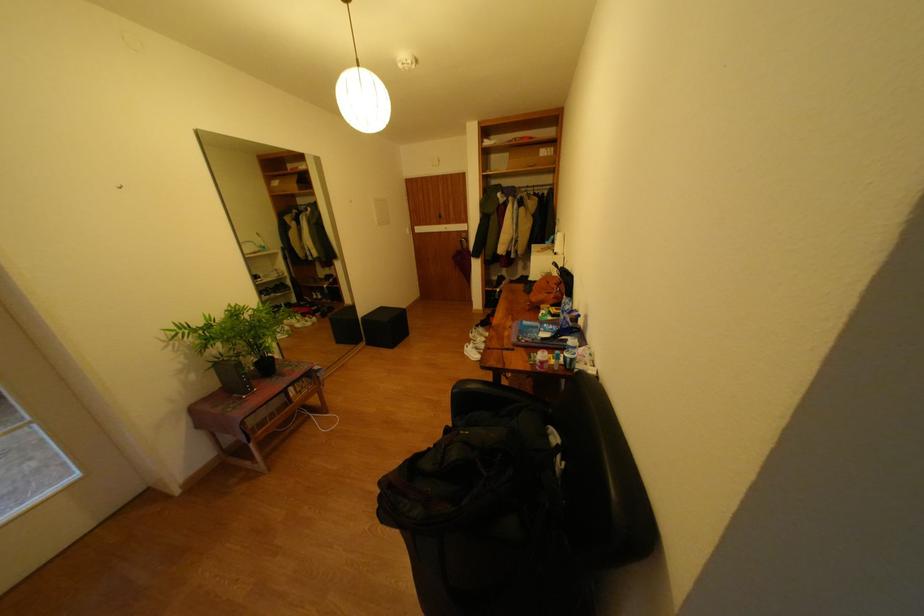
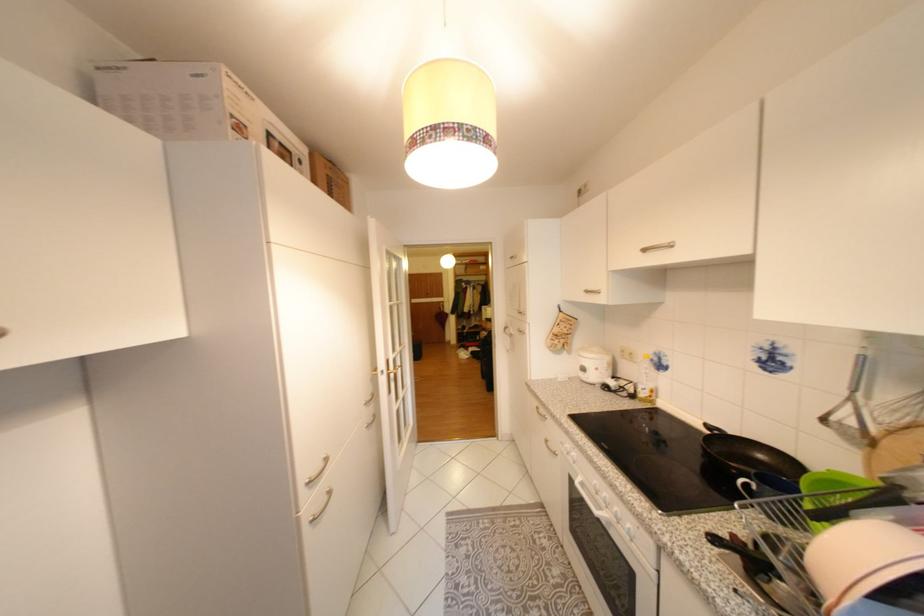
In a continuous first-person perspective shot, in which direction is the camera moving?

The cameraman moved toward left, backward.